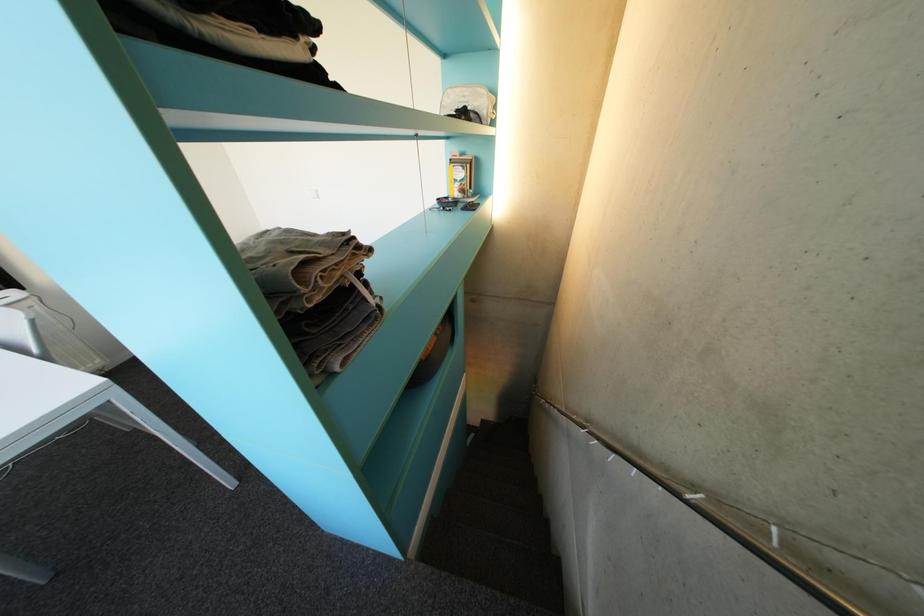
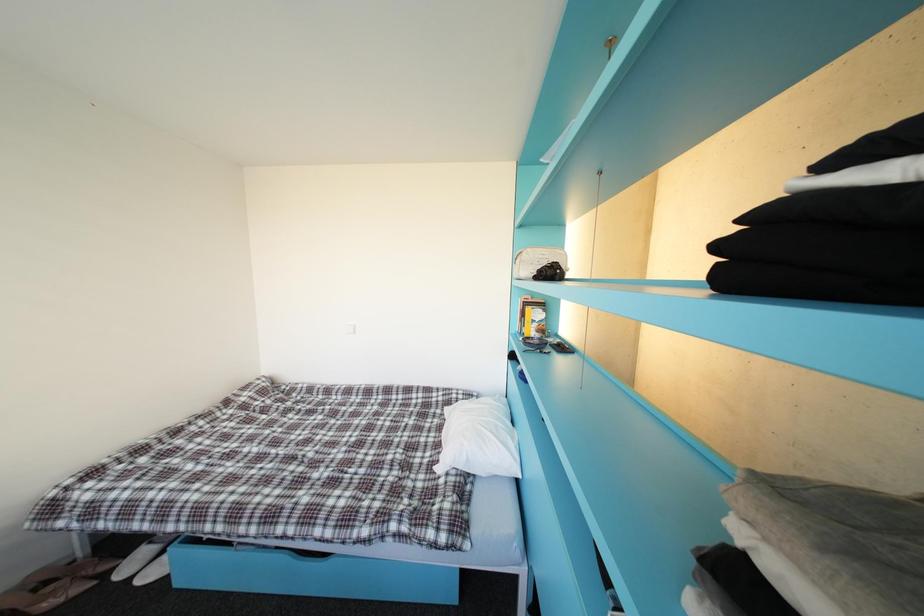
Question: The first image is from the beginning of the video and the second image is from the end. How did the camera likely rotate when shooting the video?

Choices:
 (A) Left
 (B) Right
 (C) Up
 (D) Down

Answer: (C)